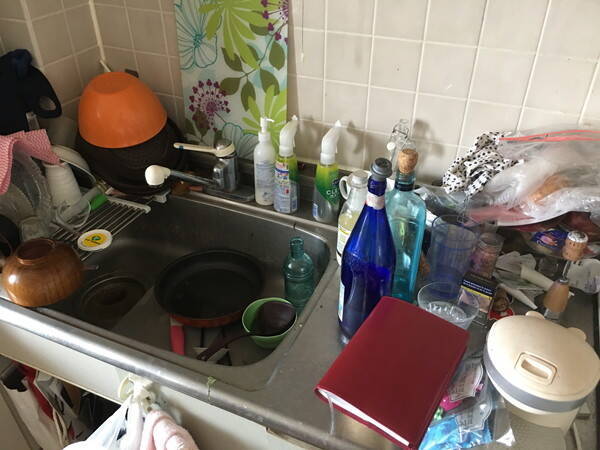
At what (x,y) coordinates should I click in order to perform the action: click on prange bowl. Please return your answer as a coordinate pair (x, y). The height and width of the screenshot is (450, 600). Looking at the image, I should click on (131, 113).